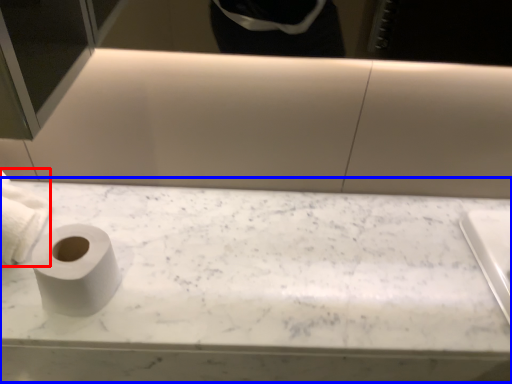
Question: Which object is closer to the camera taking this photo, toilet paper (highlighted by a red box) or counter top (highlighted by a blue box)?

Choices:
 (A) toilet paper
 (B) counter top

Answer: (A)